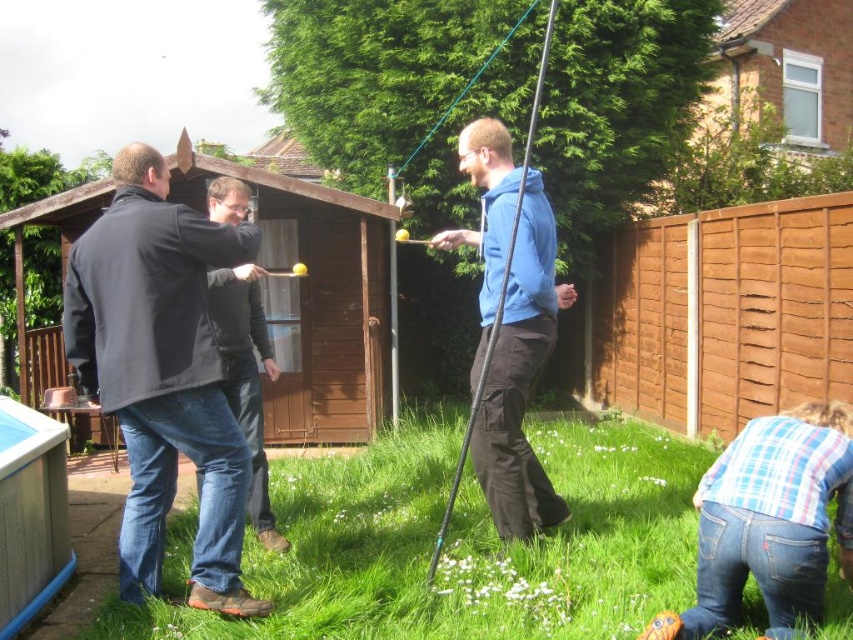
Question: Which point is closer to the camera?

Choices:
 (A) blue plaid shirt at lower right
 (B) dark blue jeans at center
 (C) blue fleece jacket at center
 (D) dark blue jacket at left

Answer: (A)

Question: Which point is closer to the camera?

Choices:
 (A) (242, 282)
 (B) (816, 449)

Answer: (B)

Question: Can you confirm if green grass at lower center is positioned to the left of blue plaid shirt at lower right?

Choices:
 (A) no
 (B) yes

Answer: (B)

Question: Which object is positioned farthest from the blue fleece jacket at center?

Choices:
 (A) green grass at lower center
 (B) dark blue jacket at left
 (C) dark blue jeans at center

Answer: (B)

Question: Is dark blue jacket at left below blue plaid shirt at lower right?

Choices:
 (A) yes
 (B) no

Answer: (B)

Question: In this image, where is blue fleece jacket at center located relative to dark blue jeans at center?

Choices:
 (A) right
 (B) left

Answer: (A)